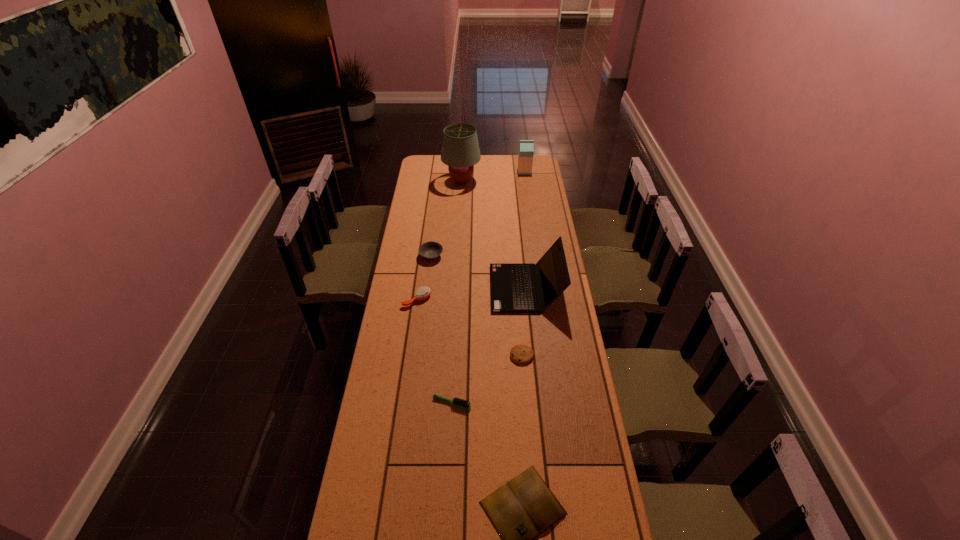
The image size is (960, 540). I want to click on bowl present at the left edge, so click(431, 250).

Find the location of a particular element. hairbrush at the left edge is located at coordinates (422, 293).

Identify the location of milk carton present at the right edge. Image resolution: width=960 pixels, height=540 pixels. (526, 147).

Image resolution: width=960 pixels, height=540 pixels. I want to click on laptop computer positioned at the right edge, so click(x=513, y=289).

Image resolution: width=960 pixels, height=540 pixels. I want to click on object positioned at the far right corner, so click(526, 147).

The width and height of the screenshot is (960, 540). Find the location of `free spot at the far edge of the desktop`. free spot at the far edge of the desktop is located at coordinates (484, 172).

Identify the location of vacant space at the left edge of the desktop. (425, 213).

I want to click on vacant space at the right edge of the desktop, so click(579, 352).

Locate an element on the screen. free point between the third farthest object and the farther hairbrush is located at coordinates (424, 278).

Locate an element on the screen. vacant area that lies between the laptop computer and the third nearest object is located at coordinates (524, 322).